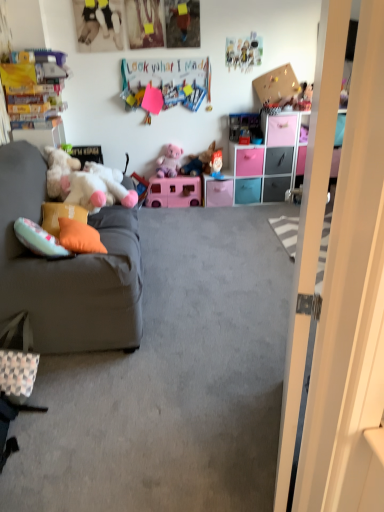
Where is `empty space that is ontop of velvet gray couch at left (from a real-world perspective)`? The width and height of the screenshot is (384, 512). empty space that is ontop of velvet gray couch at left (from a real-world perspective) is located at coordinates (190, 292).